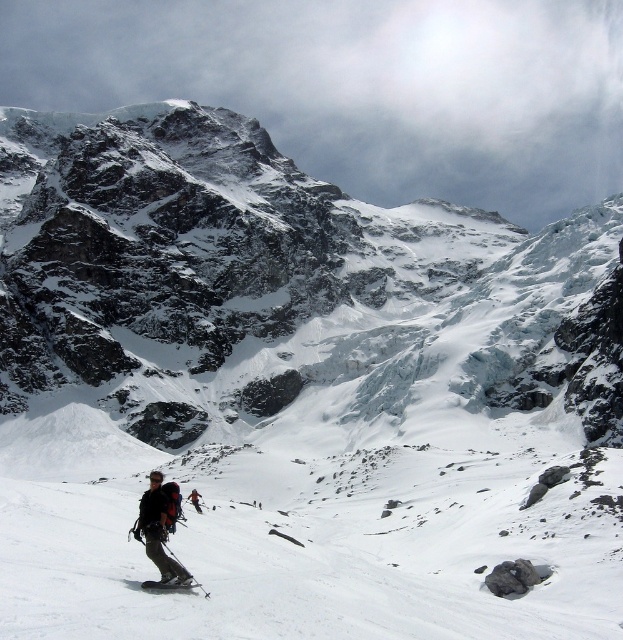
Can you confirm if black matte ski at lower center is wider than dark gray ski suit at lower left?

Yes.

Does point (176, 577) come in front of point (199, 496)?

Yes, it is.

Who is more forward, (153,586) or (191,502)?

Point (153,586) is in front.

You are a GUI agent. You are given a task and a screenshot of the screen. Output one action in this format:
    pyautogui.click(x=<x>, y=<y>)
    Task: Click on the black matte ski at lower center
    Image resolution: width=623 pixels, height=640 pixels.
    Given the screenshot: What is the action you would take?
    pyautogui.click(x=174, y=582)

Between dark gray fabric backpack at lower center and black matte ski at lower center, which one has less height?

Standing shorter between the two is black matte ski at lower center.

Between point (155, 541) and point (153, 588), which one is positioned behind?

The point (155, 541) is behind.

This screenshot has height=640, width=623. I want to click on dark gray fabric backpack at lower center, so [x=159, y=525].

Does dark gray fabric backpack at lower center have a smaller size compared to dark gray ski suit at lower left?

No.

Describe the element at coordinates (159, 525) in the screenshot. This screenshot has height=640, width=623. I see `dark gray fabric backpack at lower center` at that location.

At what (x,y) coordinates should I click in order to perform the action: click on dark gray fabric backpack at lower center. Please return your answer as a coordinate pair (x, y). This screenshot has height=640, width=623. Looking at the image, I should click on tap(159, 525).